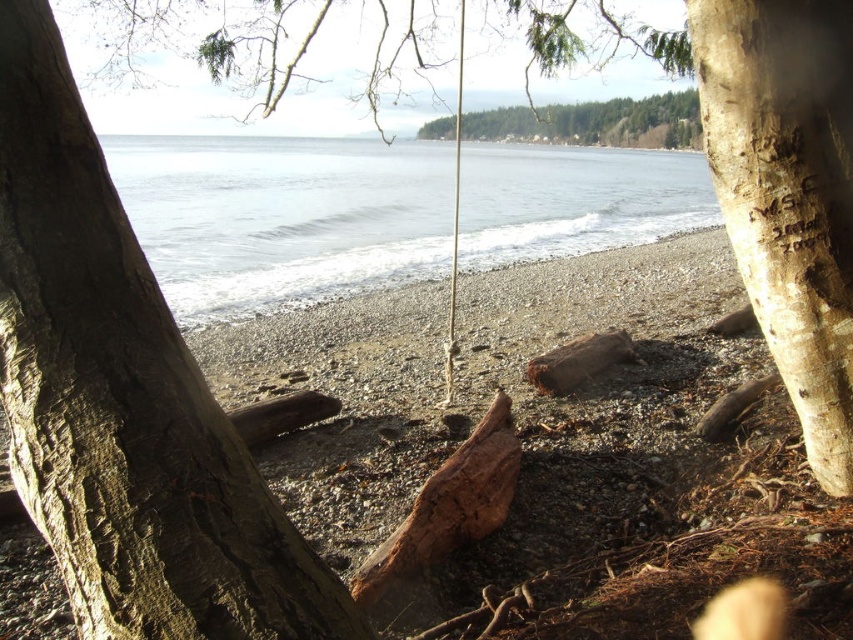
Question: Observing the image, what is the correct spatial positioning of smooth brown driftwood at center in reference to brown rough bark at center?

Choices:
 (A) left
 (B) right

Answer: (B)

Question: Which is nearer to the green textured forest at upper center?

Choices:
 (A) smooth brown driftwood at center
 (B) brown rough bark at center
 (C) light brown bark tree trunk at right
 (D) clear water at center

Answer: (D)

Question: Which is farther from the smooth brown driftwood at center?

Choices:
 (A) brown rough bark at center
 (B) light brown bark tree trunk at right

Answer: (A)

Question: Which of these objects is positioned closest to the green textured forest at upper center?

Choices:
 (A) brown rough bark at center
 (B) light brown bark tree trunk at right
 (C) clear water at center
 (D) smooth brown driftwood at center

Answer: (C)

Question: Does clear water at center come in front of green textured forest at upper center?

Choices:
 (A) no
 (B) yes

Answer: (B)

Question: In this image, where is smooth brown driftwood at center located relative to green textured forest at upper center?

Choices:
 (A) right
 (B) left

Answer: (B)